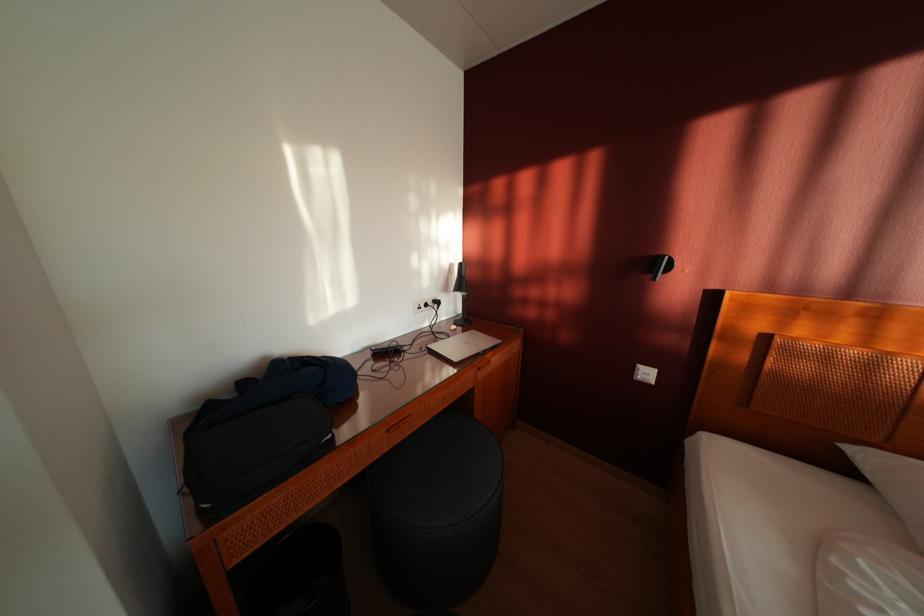
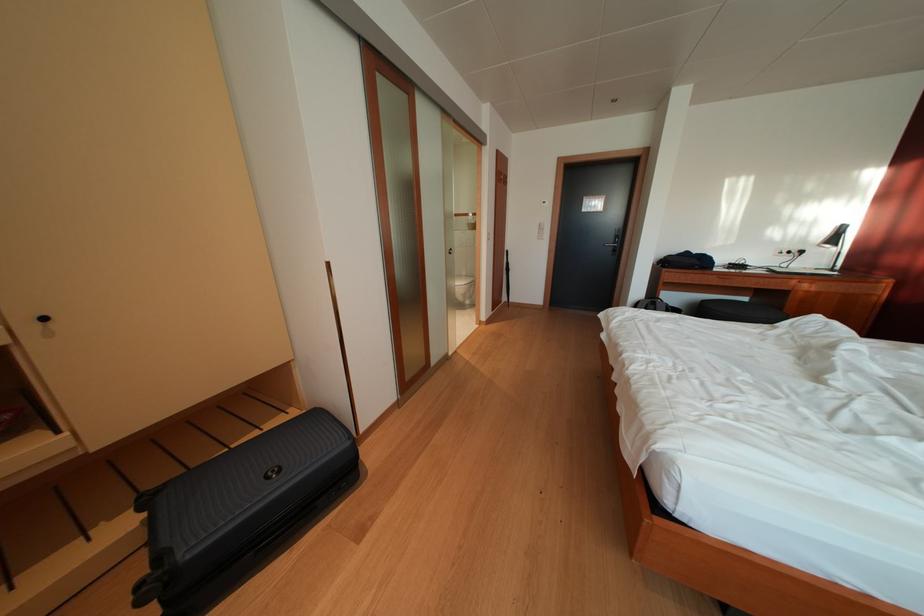
Locate, in the second image, the point that corresponds to point (445, 309) in the first image.

(809, 257)